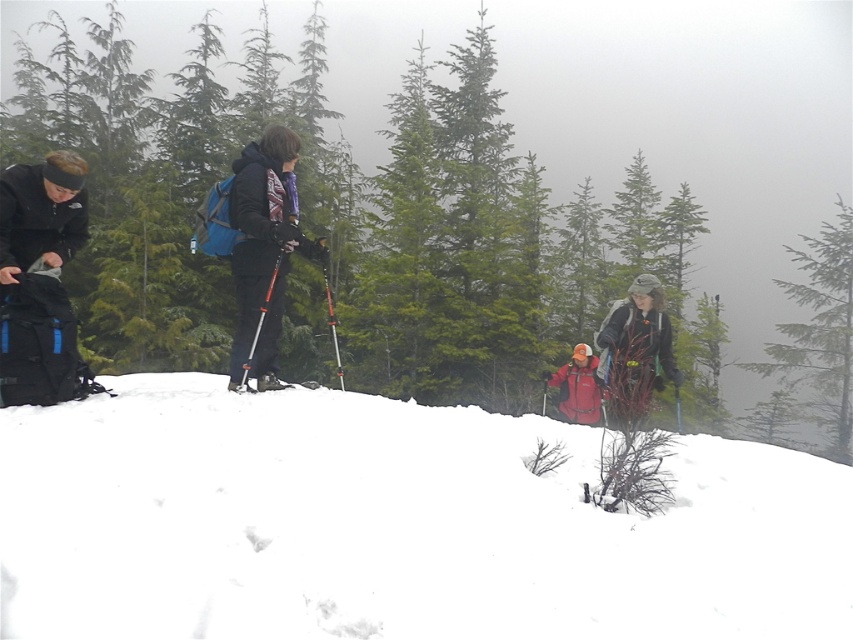
Does matte black jacket at center lie in front of black matte jacket at left?

No.

Describe the element at coordinates (263, 248) in the screenshot. I see `matte black jacket at center` at that location.

Where is `matte black jacket at center`? matte black jacket at center is located at coordinates click(x=263, y=248).

Is point (792, 378) farther from viewer compared to point (241, 381)?

Yes, point (792, 378) is behind point (241, 381).

Locate an element on the screen. The height and width of the screenshot is (640, 853). green needle-like at upper center is located at coordinates (819, 330).

Identify the location of green needle-like at upper center. This screenshot has width=853, height=640. (819, 330).

Is white snow at lower left positioned in front of dark gray woolen hat at right?

Yes, it is.

Which is below, white snow at lower left or dark gray woolen hat at right?

white snow at lower left is lower down.

Which is in front, point (788, 472) or point (646, 390)?

Point (788, 472)

Where is `white snow at lower left`? This screenshot has height=640, width=853. white snow at lower left is located at coordinates (393, 525).